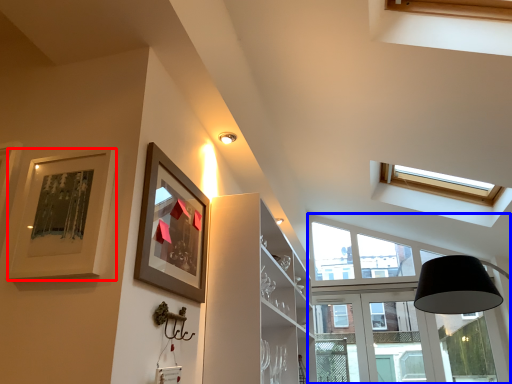
Question: Which object appears closest to the camera in this image, picture frame (highlighted by a red box) or window (highlighted by a blue box)?

Choices:
 (A) picture frame
 (B) window

Answer: (A)